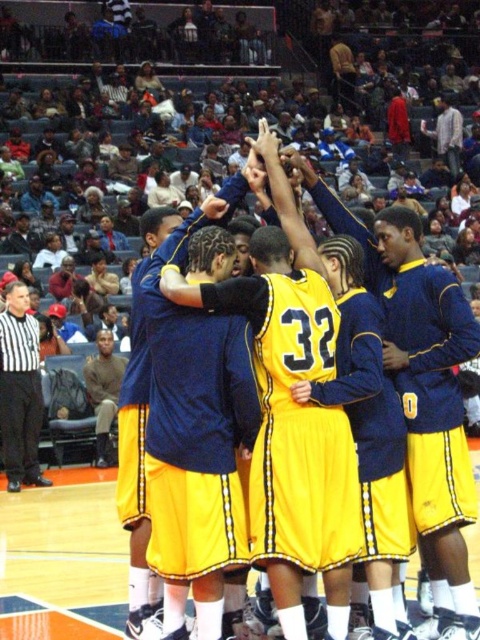
You are a photographer positioned at the back of the court. You need to take a photo of the players in the huddle so that both the yellow matte jersey at center and the white shirt at left are clearly visible. Given their heights, which player should you focus on to ensure both are in frame?

The yellow matte jersey at center is much taller than the white shirt at left. To ensure both are visible, focus on the yellow matte jersey at center since its height will help frame the scene, making the white shirt at left also visible in the shot.

You are a spectator at the basketball game. You want to take a photo of the yellow shiny jersey at center. The camera you have can only focus on objects within a 0.5 unit radius around the point you select. If you choose the point marked as point (297, 424), will the camera focus on the yellow shiny jersey at center?

The yellow shiny jersey at center is represented by point (297, 424), so yes, the camera will focus on the yellow shiny jersey at center since the focus point is exactly at its location.